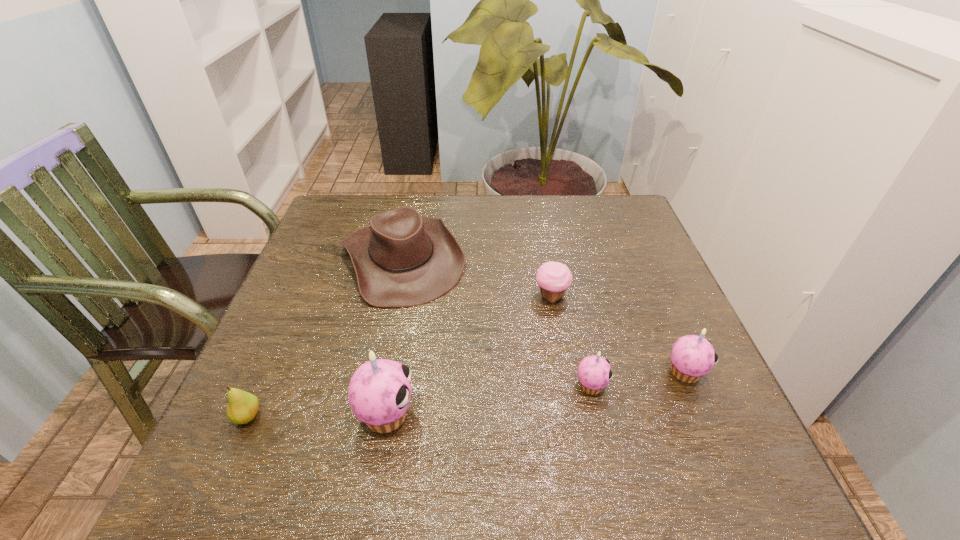
The height and width of the screenshot is (540, 960). Identify the location of spot to insert another cupcake for uniform distribution. (492, 400).